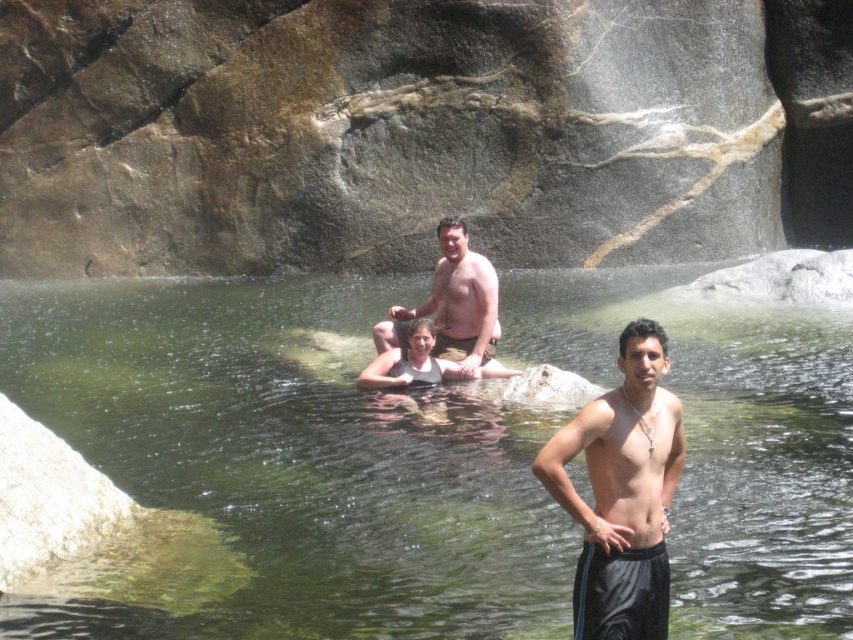
Question: Among these points, which one is farthest from the camera?

Choices:
 (A) (399, 342)
 (B) (671, 477)
 (C) (294, 592)

Answer: (A)

Question: Which of the following is the farthest from the observer?

Choices:
 (A) shiny black shorts at center
 (B) smooth tan skin at center
 (C) clear water at center

Answer: (B)

Question: Is shiny black shorts at center in front of smooth tan skin at center?

Choices:
 (A) yes
 (B) no

Answer: (A)

Question: Is shiny black shorts at center to the right of smooth tan skin at center from the viewer's perspective?

Choices:
 (A) yes
 (B) no

Answer: (A)

Question: Does shiny black shorts at center appear on the right side of smooth tan skin at center?

Choices:
 (A) yes
 (B) no

Answer: (A)

Question: Which point is closer to the camera?

Choices:
 (A) (485, 349)
 (B) (144, 557)

Answer: (B)